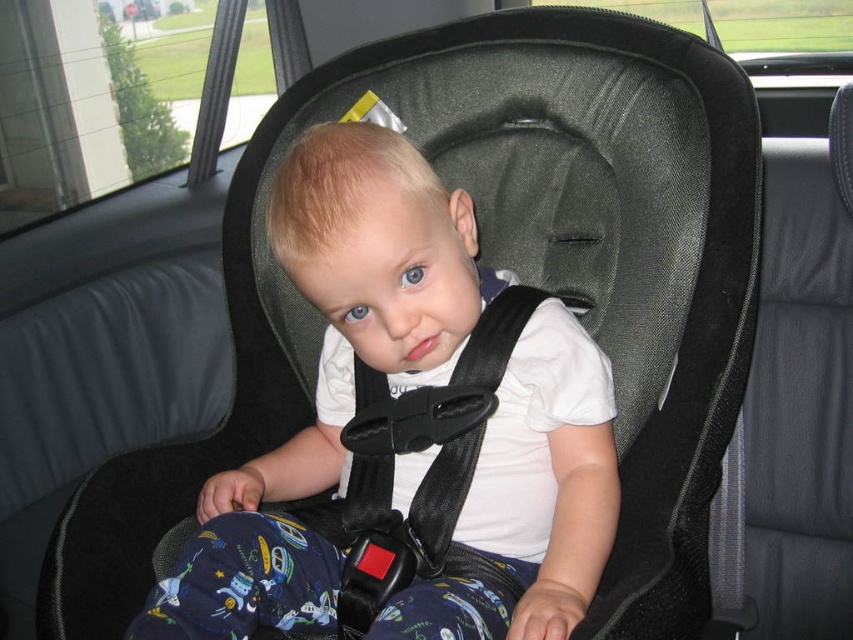
You are a safety inspector checking the distance between the car seat and the window. The car seat is at point (229,484). Can you confirm if the distance is within the recommended 90 cm safety guideline?

The distance between point (229,484) and the viewer is 86.32 centimeters, which is within the recommended 90 cm safety guideline.

From the picture: You are a safety inspector checking the car seat setup. You notice the white matte shirt at center and the black fabric strap at center. According to safety guidelines, which item should be positioned closer to the child to ensure proper harnessing?

The white matte shirt at center should be positioned closer to the child than the black fabric strap at center to ensure proper harnessing, as the shirt is in front of the strap.